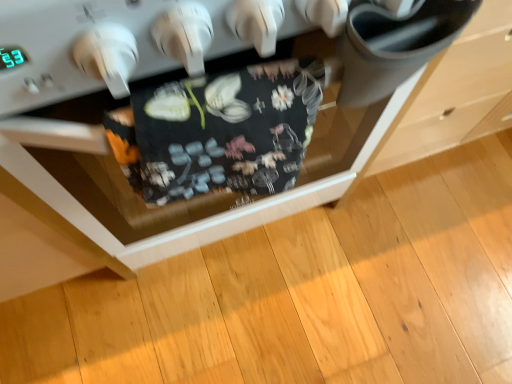
Where is `gray matte trash can at right`? Image resolution: width=512 pixels, height=384 pixels. gray matte trash can at right is located at coordinates (451, 100).

This screenshot has width=512, height=384. Describe the element at coordinates (451, 100) in the screenshot. I see `gray matte trash can at right` at that location.

In order to face gray matte trash can at right, should I rotate leftwards or rightwards?

To face it directly, rotate right by 19.842 degrees.

Identify the location of gray matte trash can at right. (451, 100).